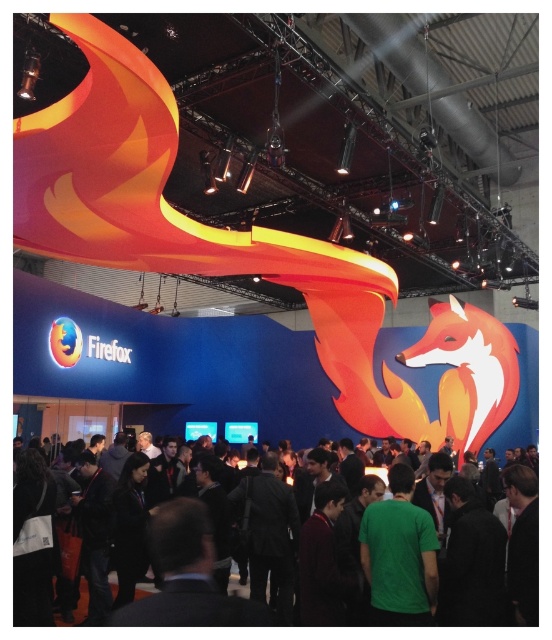
Who is lower down, green matte shirt at center or green fabric shirt at center?

green fabric shirt at center is below.

Find the location of a particular element. The width and height of the screenshot is (552, 640). green matte shirt at center is located at coordinates (400, 556).

The height and width of the screenshot is (640, 552). Identify the location of green matte shirt at center. (400, 556).